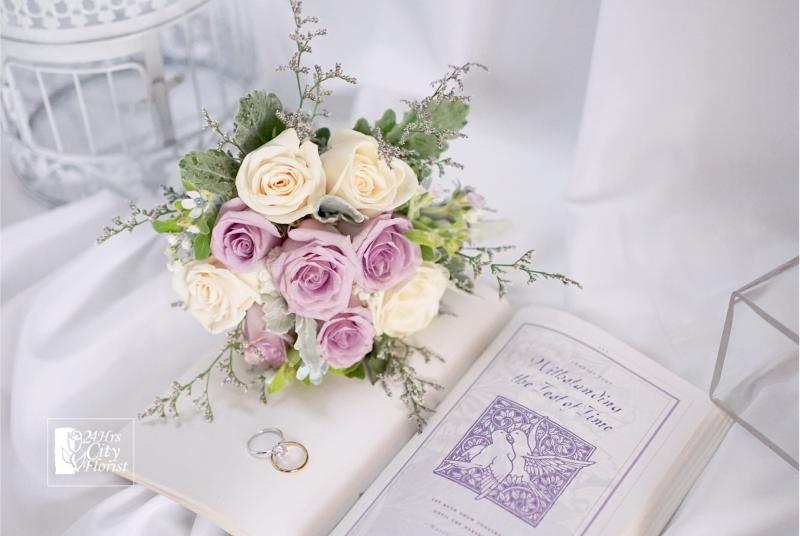
At what (x,y) coordinates should I click in order to perform the action: click on white sheet. Please return your answer as a coordinate pair (x, y). The height and width of the screenshot is (536, 800). Looking at the image, I should click on (30, 318).